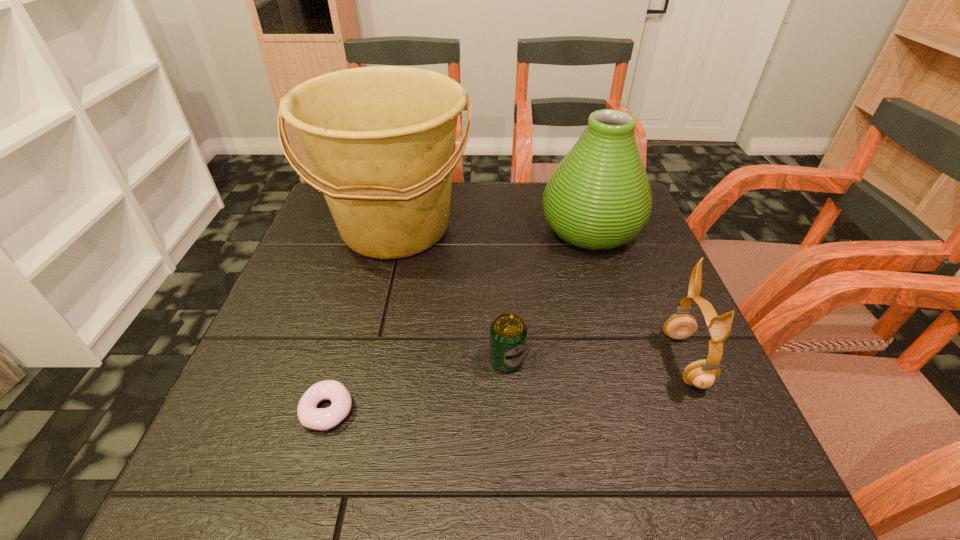
You are a GUI agent. You are given a task and a screenshot of the screen. Output one action in this format:
    pyautogui.click(x=<x>, y=<y>)
    Task: Click on the free location located 0.170m on the front-facing side of the third tallest object
    
    Given the screenshot: What is the action you would take?
    pyautogui.click(x=577, y=360)

This screenshot has height=540, width=960. I want to click on free spot located on the left of the fourth tallest object, so click(355, 360).

This screenshot has height=540, width=960. Find the location of `free space located on the right of the doughnut`. free space located on the right of the doughnut is located at coordinates (495, 410).

The height and width of the screenshot is (540, 960). Find the location of `bucket at the far edge`. bucket at the far edge is located at coordinates (381, 140).

This screenshot has height=540, width=960. Identify the location of vase at the far edge. (599, 197).

At what (x,y) coordinates should I click in order to perform the action: click on bucket present at the left edge. Please return your answer as a coordinate pair (x, y). The image size is (960, 540). Looking at the image, I should click on (381, 140).

Where is `doughnut that is at the left edge`? doughnut that is at the left edge is located at coordinates (310, 416).

Identify the location of vase situated at the right edge. (599, 197).

Locate an element on the screen. The height and width of the screenshot is (540, 960). earphone present at the right edge is located at coordinates (702, 373).

This screenshot has width=960, height=540. I want to click on object present at the far left corner, so click(381, 140).